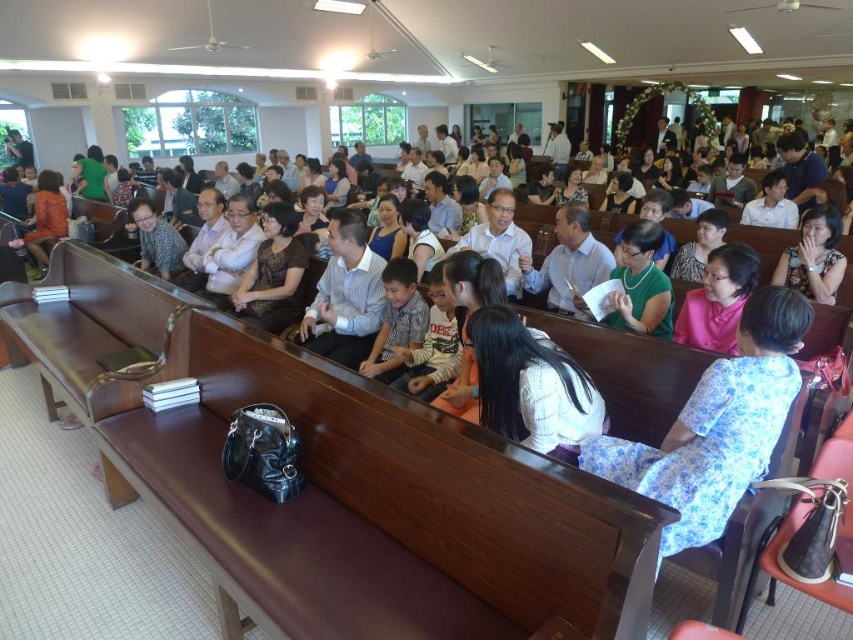
Question: From the image, what is the correct spatial relationship of blue floral dress at center in relation to blue shirt at center?

Choices:
 (A) above
 (B) below

Answer: (B)

Question: Among these objects, which one is nearest to the camera?

Choices:
 (A) matte black jacket at center
 (B) blue floral dress at center
 (C) blue shirt at center
 (D) white sweater at center

Answer: (B)

Question: Which point is closer to the camera?

Choices:
 (A) matte black jacket at center
 (B) matte green dress at center
 (C) white sweater at center

Answer: (C)

Question: Does matte green dress at center have a larger size compared to matte black jacket at center?

Choices:
 (A) yes
 (B) no

Answer: (B)

Question: Which of the following is the farthest from the observer?

Choices:
 (A) (779, 262)
 (B) (36, 260)
 (C) (788, 408)
 (D) (361, 344)

Answer: (B)

Question: Does matte green dress at center appear under matte black jacket at center?

Choices:
 (A) no
 (B) yes

Answer: (B)